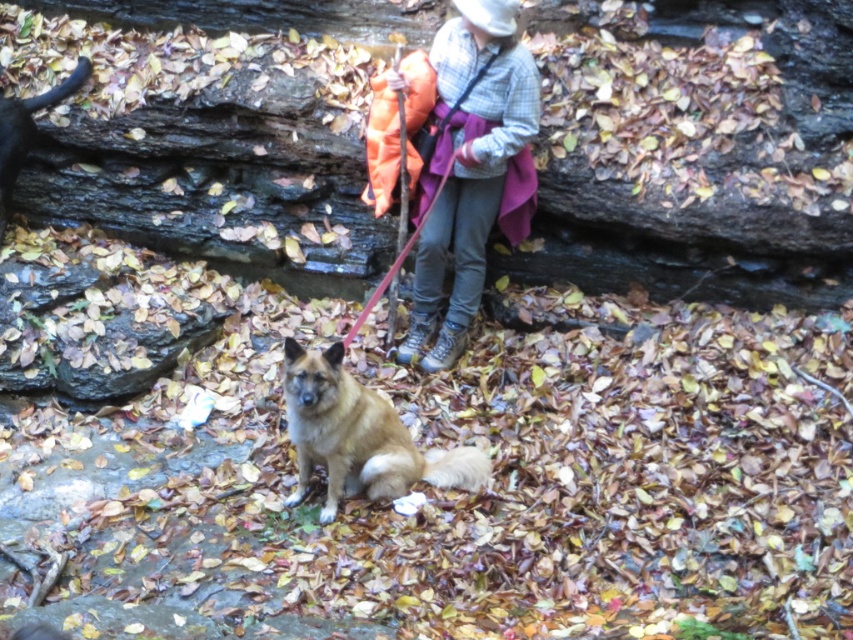
Between point (505, 188) and point (287, 364), which one is positioned in front?

Point (287, 364) is more forward.

Between plaid flannel shirt at upper center and brown fur dog at center, which one appears on the right side from the viewer's perspective?

Positioned to the right is plaid flannel shirt at upper center.

Is point (469, 228) farther from viewer compared to point (328, 358)?

Yes.

The height and width of the screenshot is (640, 853). What are the coordinates of `plaid flannel shirt at upper center` in the screenshot? It's located at (473, 170).